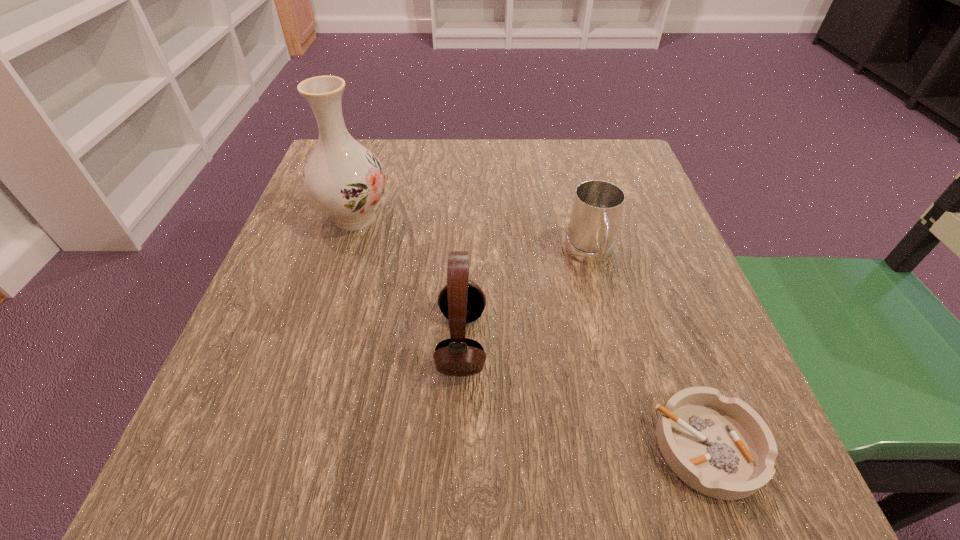
Where is `vacant region between the second tallest object and the ashtray`? Image resolution: width=960 pixels, height=540 pixels. vacant region between the second tallest object and the ashtray is located at coordinates (585, 394).

Locate an element on the screen. This screenshot has width=960, height=540. object that stands as the closest to the ashtray is located at coordinates (461, 301).

You are a GUI agent. You are given a task and a screenshot of the screen. Output one action in this format:
    pyautogui.click(x=<x>, y=<y>)
    Task: Click on the object that stands as the second closest to the vase
    
    Given the screenshot: What is the action you would take?
    pyautogui.click(x=597, y=206)

This screenshot has width=960, height=540. Find the location of `free space that satisfies the following two spatial constraints: 1. on the side of the mug with the handle; 2. on the ear pads of the headset`. free space that satisfies the following two spatial constraints: 1. on the side of the mug with the handle; 2. on the ear pads of the headset is located at coordinates (612, 342).

I want to click on vacant space that satisfies the following two spatial constraints: 1. on the front side of the vase; 2. on the right side of the ashtray, so click(282, 447).

Locate an element on the screen. Image resolution: width=960 pixels, height=540 pixels. free space that satisfies the following two spatial constraints: 1. on the front side of the shortest object; 2. on the right side of the leftmost object is located at coordinates (282, 447).

Where is `vacant point that satisfies the following two spatial constraints: 1. on the ear pads of the second tallest object; 2. on the right side of the ashtray`? vacant point that satisfies the following two spatial constraints: 1. on the ear pads of the second tallest object; 2. on the right side of the ashtray is located at coordinates (458, 447).

Identify the location of vacant region that satisfies the following two spatial constraints: 1. on the side of the second shortest object with the handle; 2. on the ear pads of the headset. (612, 342).